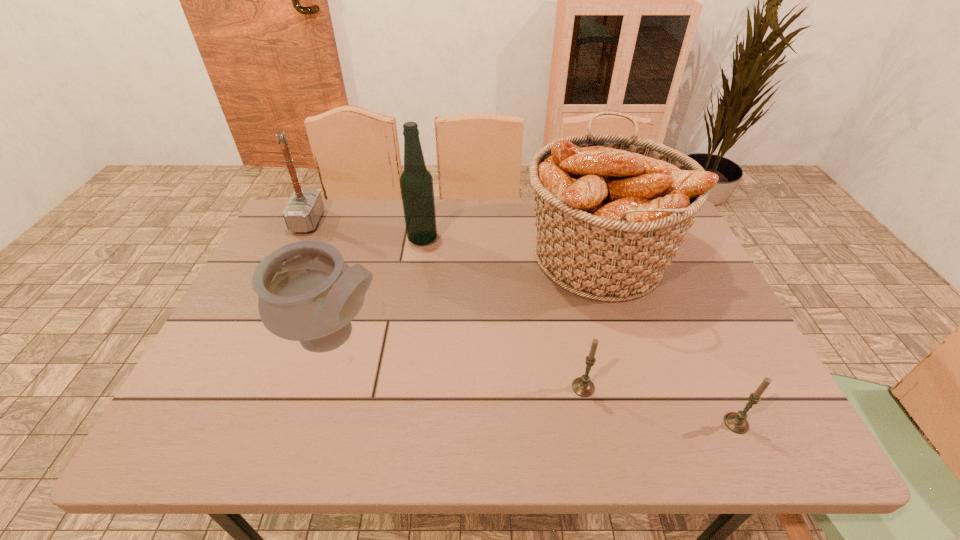
What are the coordinates of `alcohol` in the screenshot? It's located at pyautogui.click(x=416, y=183).

Where is `basket`? The image size is (960, 540). basket is located at coordinates (612, 210).

Where is `the leftmost object`? The height and width of the screenshot is (540, 960). the leftmost object is located at coordinates (305, 207).

Identify the location of pottery. The width and height of the screenshot is (960, 540). (307, 293).

You are a GUI agent. You are given a task and a screenshot of the screen. Output one action in this format:
    pyautogui.click(x=<x>, y=<y>)
    Task: Click on the left candle
    The width and height of the screenshot is (960, 540).
    Given the screenshot: What is the action you would take?
    pyautogui.click(x=583, y=386)

Where is `the second nearest object`? This screenshot has height=540, width=960. the second nearest object is located at coordinates (583, 386).

I want to click on the nearer candle, so click(736, 422).

Identify the location of the right candle. (736, 422).

You are a GUI agent. You are given a task and a screenshot of the screen. Output one action in this format:
    pyautogui.click(x=<x>, y=<y>)
    Task: Click on the free space located 0.110m on the back of the alcohol
    The image size is (960, 540).
    Given the screenshot: What is the action you would take?
    pyautogui.click(x=427, y=209)

Where is `vacant space located 0.110m on the left of the basket`? Image resolution: width=960 pixels, height=540 pixels. vacant space located 0.110m on the left of the basket is located at coordinates (483, 258).